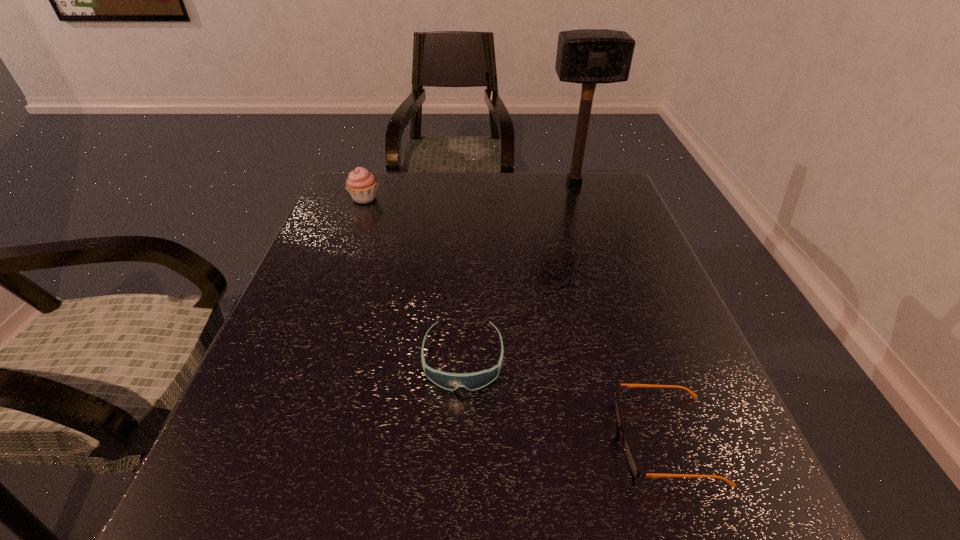
Locate an element on the screen. mallet is located at coordinates (589, 56).

This screenshot has height=540, width=960. In order to click on the third shortest object in this screenshot , I will do `click(361, 184)`.

Where is `the leftmost object`? This screenshot has width=960, height=540. the leftmost object is located at coordinates (361, 184).

Where is `the third farthest object`? Image resolution: width=960 pixels, height=540 pixels. the third farthest object is located at coordinates (450, 381).

What are the coordinates of `the second shortest object` in the screenshot? It's located at (450, 381).

Find the location of a particular element. The height and width of the screenshot is (540, 960). spectacles is located at coordinates (634, 467).

Where is `the nearest object`? This screenshot has width=960, height=540. the nearest object is located at coordinates (634, 467).

Find the location of a particular element. The width and height of the screenshot is (960, 540). free location located on the right of the mallet is located at coordinates (619, 184).

Locate an element on the screen. This screenshot has height=540, width=960. free space located 0.150m on the front of the second tallest object is located at coordinates (349, 239).

Find the location of `free space located 0.210m on the front-facing side of the second object from left to right`. free space located 0.210m on the front-facing side of the second object from left to right is located at coordinates coord(457,524).